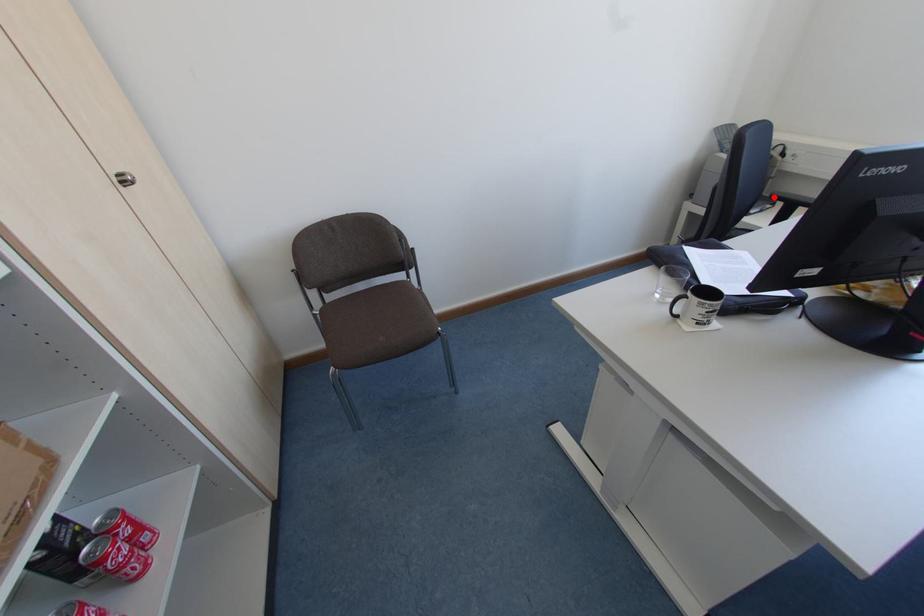
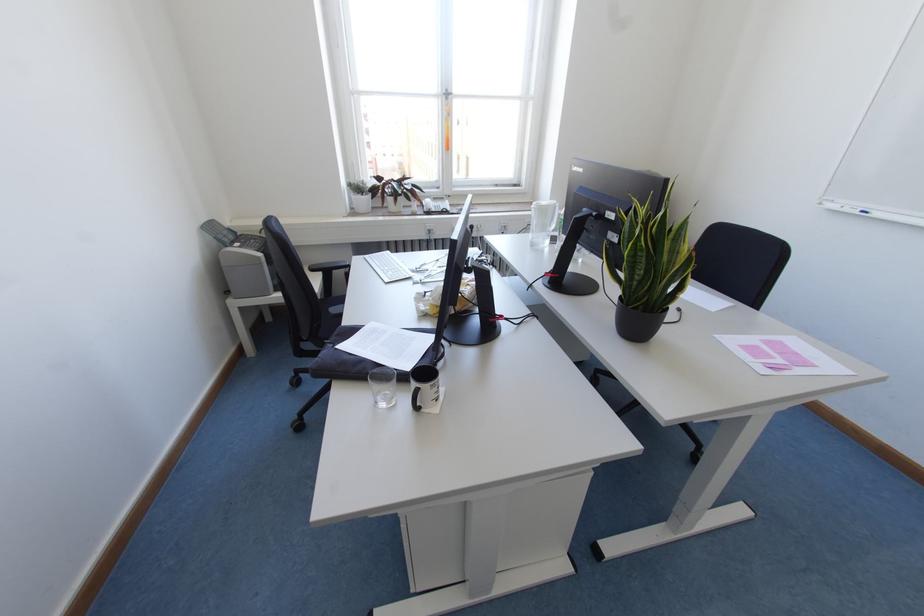
Question: I am providing you with two images of the same scene from different viewpoints. In image1, a red point is highlighted. Considering the same 3D point in image2, which of the following is correct?

Choices:
 (A) It is closer
 (B) It is farther

Answer: (A)